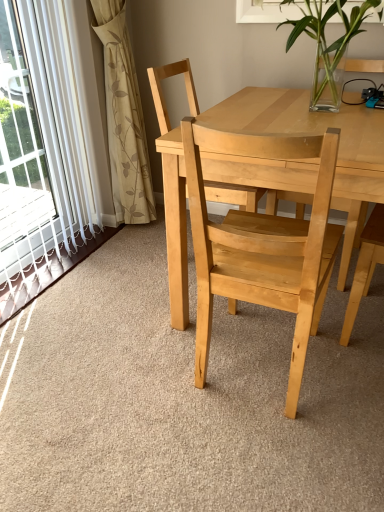
Describe the element at coordinates (263, 244) in the screenshot. I see `natural wood chair at center, the 2th chair when ordered from back to front` at that location.

Measure the distance between point (131, 159) and camera.

Point (131, 159) and camera are 2.17 meters apart from each other.

At what (x,y) coordinates should I click in order to perform the action: click on natural wood chair at center, the 1th chair viewed from the back. Please return your answer as a coordinate pair (x, y). Looking at the image, I should click on (162, 94).

Is beige floral fabric curtain at left oriented towards natural wood chair at center, marked as the 2th chair in a front-to-back arrangement?

Yes, beige floral fabric curtain at left faces towards natural wood chair at center, marked as the 2th chair in a front-to-back arrangement.

Which point is more distant from viewer, (108, 92) or (233, 188)?

The point (108, 92) is farther from the camera.

From the image's perspective, which is below, beige floral fabric curtain at left or natural wood chair at center, marked as the 2th chair in a front-to-back arrangement?

From the image's view, natural wood chair at center, marked as the 2th chair in a front-to-back arrangement, is below.

Who is smaller, natural wood chair at center, marked as the 2th chair in a front-to-back arrangement, or beige floral fabric curtain at left?

With smaller size is beige floral fabric curtain at left.

Choose the correct answer: Is natural wood chair at center, marked as the 2th chair in a front-to-back arrangement, inside beige floral fabric curtain at left or outside it?

natural wood chair at center, marked as the 2th chair in a front-to-back arrangement, is spatially situated outside beige floral fabric curtain at left.

Is natural wood chair at center, the 1th chair viewed from the back, positioned in front of beige floral fabric curtain at left?

That is True.

What's the angular difference between natural wood chair at center, marked as the 2th chair in a front-to-back arrangement, and beige floral fabric curtain at left's facing directions?

The facing directions of natural wood chair at center, marked as the 2th chair in a front-to-back arrangement, and beige floral fabric curtain at left are 2 degrees apart.

Is natural wood chair at center, the 2th chair when ordered from back to front, at the left side of natural wood chair at center, marked as the 2th chair in a front-to-back arrangement?

No.

Locate an element on the screen. Image resolution: width=384 pixels, height=512 pixels. chair on the left of natural wood chair at center, placed as the first chair when sorted from front to back is located at coordinates (162, 94).

From the image's perspective, is natural wood chair at center, the 2th chair when ordered from back to front, positioned above or below natural wood chair at center, marked as the 2th chair in a front-to-back arrangement?

natural wood chair at center, the 2th chair when ordered from back to front, is situated lower than natural wood chair at center, marked as the 2th chair in a front-to-back arrangement, in the image.

Who is smaller, clear glass vase at upper center or beige floral fabric curtain at left?

With smaller size is beige floral fabric curtain at left.

From the image's perspective, does clear glass vase at upper center appear lower than beige floral fabric curtain at left?

No, from the image's perspective, clear glass vase at upper center is not below beige floral fabric curtain at left.

From a real-world perspective, is clear glass vase at upper center physically above beige floral fabric curtain at left?

Yes.

How distant is clear glass vase at upper center from beige floral fabric curtain at left?

clear glass vase at upper center and beige floral fabric curtain at left are 96.13 centimeters apart.

In the scene shown: Is clear glass vase at upper center next to natural wood chair at center, the 1th chair viewed from the back?

A: No, clear glass vase at upper center is not beside natural wood chair at center, the 1th chair viewed from the back.

In the scene shown: What's the angular difference between clear glass vase at upper center and natural wood chair at center, the 1th chair viewed from the back,'s facing directions?

They differ by 88 degrees in their facing directions.

Is clear glass vase at upper center shorter than natural wood chair at center, the 1th chair viewed from the back?

Correct, clear glass vase at upper center is not as tall as natural wood chair at center, the 1th chair viewed from the back.

From a real-world perspective, is clear glass vase at upper center physically located above or below natural wood chair at center, the 1th chair viewed from the back?

clear glass vase at upper center is situated higher than natural wood chair at center, the 1th chair viewed from the back, in the real world.

Would you say clear glass vase at upper center is inside or outside natural wood chair at center, placed as the first chair when sorted from front to back?

clear glass vase at upper center is located beyond the bounds of natural wood chair at center, placed as the first chair when sorted from front to back.

Does clear glass vase at upper center turn towards natural wood chair at center, the 2th chair when ordered from back to front?

No, clear glass vase at upper center is not facing towards natural wood chair at center, the 2th chair when ordered from back to front.

Consider the image. From the image's perspective, is clear glass vase at upper center above or below natural wood chair at center, the 2th chair when ordered from back to front?

Based on their image positions, clear glass vase at upper center is located above natural wood chair at center, the 2th chair when ordered from back to front.

Looking at the image, does clear glass vase at upper center seem bigger or smaller compared to natural wood chair at center, placed as the first chair when sorted from front to back?

Considering their sizes, clear glass vase at upper center takes up less space than natural wood chair at center, placed as the first chair when sorted from front to back.

From a real-world perspective, is natural wood chair at center, the 1th chair viewed from the back, physically above natural wood chair at center, the 2th chair when ordered from back to front?

Yes, from a real-world perspective, natural wood chair at center, the 1th chair viewed from the back, is over natural wood chair at center, the 2th chair when ordered from back to front

Where is `chair to the left of natural wood chair at center, placed as the first chair when sorted from front to back`? The width and height of the screenshot is (384, 512). chair to the left of natural wood chair at center, placed as the first chair when sorted from front to back is located at coordinates (162, 94).

This screenshot has height=512, width=384. In order to click on curtain above the natural wood chair at center, marked as the 2th chair in a front-to-back arrangement (from the image's perspective) in this screenshot , I will do `click(124, 118)`.

Where is `curtain behind the natural wood chair at center, marked as the 2th chair in a front-to-back arrangement`? The width and height of the screenshot is (384, 512). curtain behind the natural wood chair at center, marked as the 2th chair in a front-to-back arrangement is located at coordinates (124, 118).

Looking at the image, which one is located further to natural wood chair at center, marked as the 2th chair in a front-to-back arrangement, clear glass vase at upper center or beige floral fabric curtain at left?

Among the two, clear glass vase at upper center is located further to natural wood chair at center, marked as the 2th chair in a front-to-back arrangement.

From the image, which object appears to be nearer to beige floral fabric curtain at left, natural wood chair at center, placed as the first chair when sorted from front to back, or clear glass vase at upper center?

clear glass vase at upper center is positioned closer to the anchor beige floral fabric curtain at left.

Estimate the real-world distances between objects in this image. Which object is further from natural wood chair at center, placed as the first chair when sorted from front to back, beige floral fabric curtain at left or clear glass vase at upper center?

beige floral fabric curtain at left is further to natural wood chair at center, placed as the first chair when sorted from front to back.

From the picture: Estimate the real-world distances between objects in this image. Which object is further from natural wood chair at center, marked as the 2th chair in a front-to-back arrangement, natural wood chair at center, placed as the first chair when sorted from front to back, or clear glass vase at upper center?

Among the two, natural wood chair at center, placed as the first chair when sorted from front to back, is located further to natural wood chair at center, marked as the 2th chair in a front-to-back arrangement.

When comparing their distances from natural wood chair at center, placed as the first chair when sorted from front to back, does beige floral fabric curtain at left or natural wood chair at center, marked as the 2th chair in a front-to-back arrangement, seem further?

beige floral fabric curtain at left.

Looking at the image, which one is located further to beige floral fabric curtain at left, natural wood chair at center, placed as the first chair when sorted from front to back, or natural wood chair at center, the 1th chair viewed from the back?

natural wood chair at center, placed as the first chair when sorted from front to back, lies further to beige floral fabric curtain at left than the other object.

When comparing their distances from clear glass vase at upper center, does beige floral fabric curtain at left or natural wood chair at center, placed as the first chair when sorted from front to back, seem further?

beige floral fabric curtain at left lies further to clear glass vase at upper center than the other object.

When comparing their distances from natural wood chair at center, marked as the 2th chair in a front-to-back arrangement, does beige floral fabric curtain at left or natural wood chair at center, placed as the first chair when sorted from front to back, seem closer?

beige floral fabric curtain at left lies closer to natural wood chair at center, marked as the 2th chair in a front-to-back arrangement, than the other object.

At what (x,y) coordinates should I click in order to perform the action: click on chair positioned between natural wood chair at center, the 2th chair when ordered from back to front, and beige floral fabric curtain at left from near to far. Please return your answer as a coordinate pair (x, y). This screenshot has height=512, width=384. Looking at the image, I should click on (162, 94).

This screenshot has height=512, width=384. In order to click on houseplant between natural wood chair at center, placed as the first chair when sorted from front to back, and beige floral fabric curtain at left, along the z-axis in this screenshot , I will do `click(326, 42)`.

This screenshot has height=512, width=384. In order to click on chair between clear glass vase at upper center and natural wood chair at center, placed as the first chair when sorted from front to back, vertically in this screenshot , I will do `click(162, 94)`.